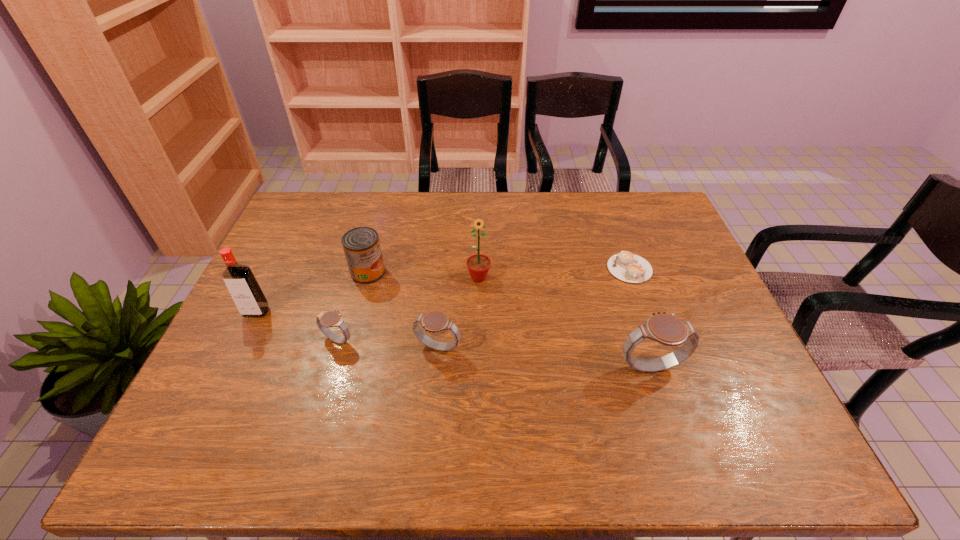
The image size is (960, 540). In order to click on blank space located 0.260m on the right of the leftmost watch in this screenshot , I will do `click(455, 340)`.

Image resolution: width=960 pixels, height=540 pixels. I want to click on vacant space located on the back of the second watch from left to right, so click(x=444, y=278).

This screenshot has height=540, width=960. What are the coordinates of `vacant region located 0.170m on the back of the rightmost watch` in the screenshot? It's located at (629, 302).

This screenshot has height=540, width=960. In order to click on free spot located on the right of the cappuccino in this screenshot , I will do `click(694, 268)`.

This screenshot has width=960, height=540. Identify the location of free location located 0.260m on the front and back of the vodka. (211, 404).

At what (x,y) coordinates should I click in order to perform the action: click on free spot located 0.370m on the face of the fifth object from left to right. Please return your answer as a coordinate pair (x, y). The height and width of the screenshot is (540, 960). Looking at the image, I should click on (x=478, y=399).

This screenshot has width=960, height=540. I want to click on free location located on the back of the can, so click(386, 206).

Identify the location of object situated at the near edge. (666, 329).

Where is `object located in the left edge section of the desktop`? The image size is (960, 540). object located in the left edge section of the desktop is located at coordinates (245, 291).

Locate an element on the screen. Image resolution: width=960 pixels, height=540 pixels. watch present at the right edge is located at coordinates pyautogui.click(x=666, y=329).